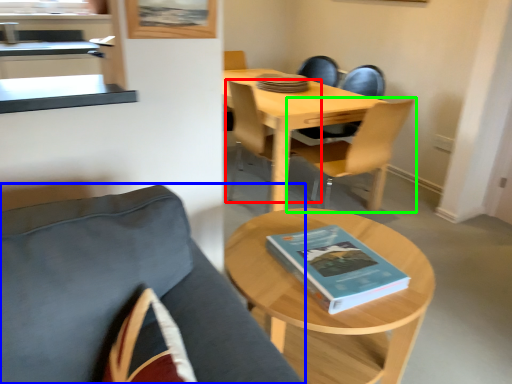
Question: Which is farther away from chair (highlighted by a red box)? chair (highlighted by a blue box) or chair (highlighted by a green box)?

Choices:
 (A) chair
 (B) chair

Answer: (A)